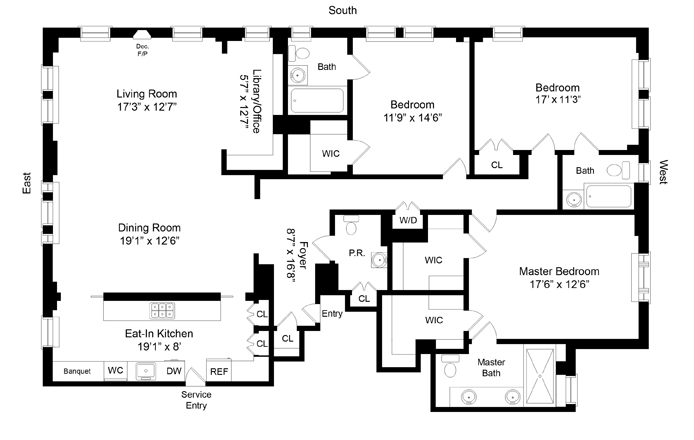
At what (x,y) coordinates should I click in order to perform the action: click on 2nd bedroom. Please return your answer as a coordinate pair (x, y). The width and height of the screenshot is (694, 440). Looking at the image, I should click on (446, 119).